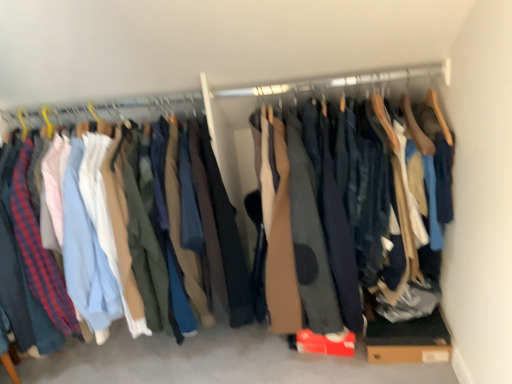
Question: Should I look upward or downward to see dark blue cotton pants at left?

Choices:
 (A) up
 (B) down

Answer: (B)

Question: Is brown cardboard box at lower right oriented away from dark blue cotton pants at left?

Choices:
 (A) yes
 (B) no

Answer: (B)

Question: Is brown cardboard box at lower right outside of dark blue cotton pants at left?

Choices:
 (A) yes
 (B) no

Answer: (A)

Question: Does brown cardboard box at lower right have a lesser height compared to dark blue cotton pants at left?

Choices:
 (A) yes
 (B) no

Answer: (A)

Question: Is brown cardboard box at lower right behind dark blue cotton pants at left?

Choices:
 (A) no
 (B) yes

Answer: (B)

Question: Can you confirm if brown cardboard box at lower right is positioned to the left of dark blue cotton pants at left?

Choices:
 (A) yes
 (B) no

Answer: (B)

Question: Considering the relative sizes of brown cardboard box at lower right and dark blue cotton pants at left in the image provided, is brown cardboard box at lower right bigger than dark blue cotton pants at left?

Choices:
 (A) yes
 (B) no

Answer: (B)

Question: Can you confirm if dark blue cotton pants at left is shorter than brown cardboard box at lower right?

Choices:
 (A) yes
 (B) no

Answer: (B)

Question: Can you confirm if dark blue cotton pants at left is smaller than brown cardboard box at lower right?

Choices:
 (A) yes
 (B) no

Answer: (B)

Question: Is dark blue cotton pants at left positioned far away from brown cardboard box at lower right?

Choices:
 (A) yes
 (B) no

Answer: (B)

Question: From the image's perspective, is dark blue cotton pants at left located above brown cardboard box at lower right?

Choices:
 (A) no
 (B) yes

Answer: (B)

Question: Is dark blue cotton pants at left positioned beyond the bounds of brown cardboard box at lower right?

Choices:
 (A) yes
 (B) no

Answer: (A)

Question: Is dark blue cotton pants at left wider than brown cardboard box at lower right?

Choices:
 (A) no
 (B) yes

Answer: (B)

Question: Is the surface of brown cardboard box at lower right in direct contact with wooden hanger at upper center?

Choices:
 (A) no
 (B) yes

Answer: (A)